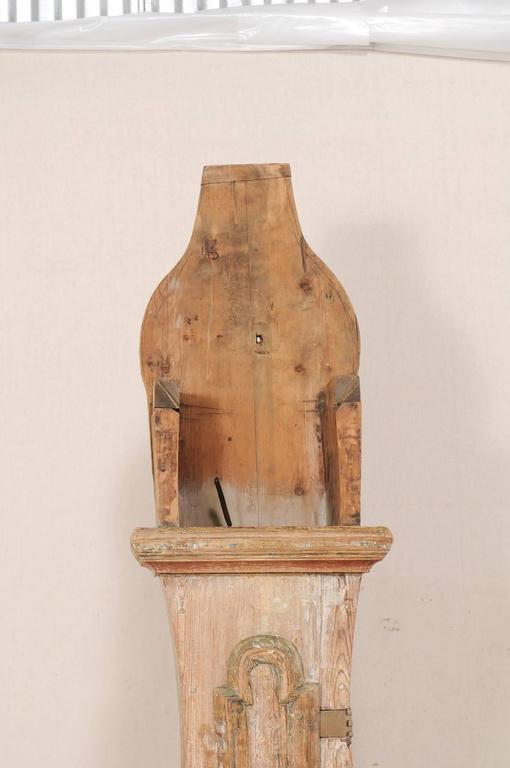
Identify the location of door hinge. The height and width of the screenshot is (768, 510). (348, 722).